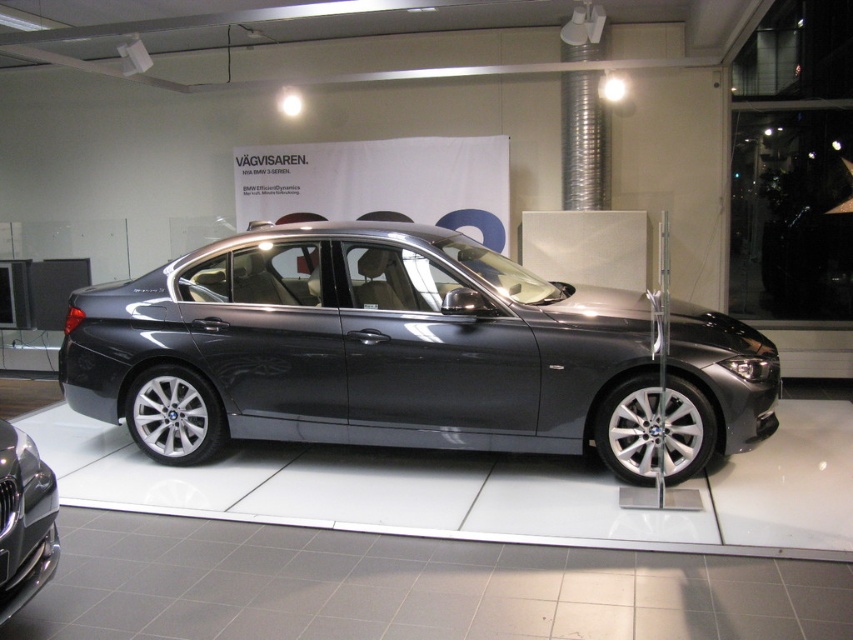
Question: Which point is closer to the camera?

Choices:
 (A) (16, 525)
 (B) (471, 291)

Answer: (A)

Question: Can you confirm if satin metallic car at center is smaller than glossy black car at lower left?

Choices:
 (A) yes
 (B) no

Answer: (B)

Question: Which object is closer to the camera taking this photo?

Choices:
 (A) glossy black car at lower left
 (B) satin metallic car at center

Answer: (A)

Question: Which object appears farthest from the camera in this image?

Choices:
 (A) glossy black car at lower left
 (B) satin metallic car at center

Answer: (B)

Question: Does satin metallic car at center have a greater width compared to glossy black car at lower left?

Choices:
 (A) no
 (B) yes

Answer: (B)

Question: Can you confirm if satin metallic car at center is positioned above glossy black car at lower left?

Choices:
 (A) yes
 (B) no

Answer: (A)